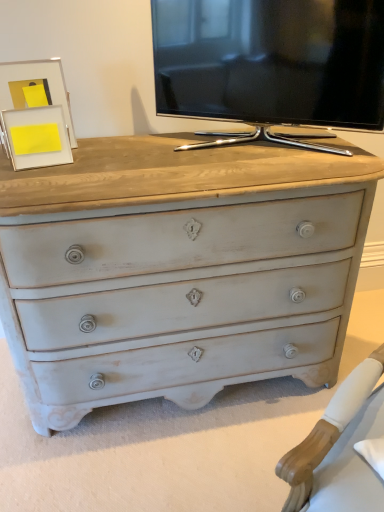
Question: Is point (193, 102) positioned closer to the camera than point (13, 106)?

Choices:
 (A) closer
 (B) farther

Answer: (B)

Question: Would you say black glossy tv at upper center is inside or outside matte white picture frame at upper left, positioned as the second picture frame in front-to-back order?

Choices:
 (A) inside
 (B) outside

Answer: (B)

Question: Considering the real-world distances, which object is closest to the matte white picture frame at upper left, positioned as the 1th picture frame in back-to-front order?

Choices:
 (A) black glossy tv at upper center
 (B) matte white picture frame at upper left, positioned as the 1th picture frame in front-to-back order

Answer: (B)

Question: Estimate the real-world distances between objects in this image. Which object is farther from the matte white picture frame at upper left, positioned as the second picture frame in front-to-back order?

Choices:
 (A) black glossy tv at upper center
 (B) matte white picture frame at upper left, which appears as the second picture frame when viewed from the back

Answer: (A)